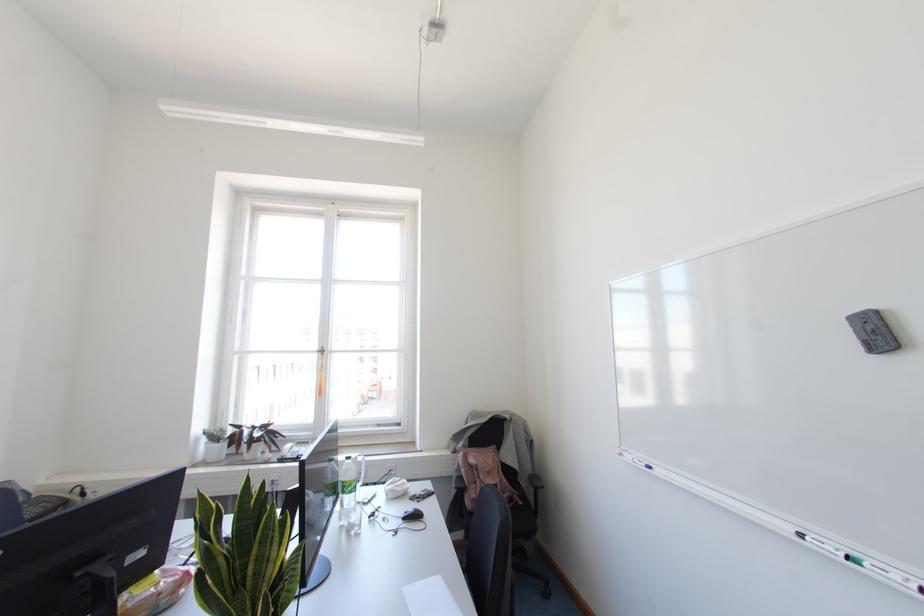
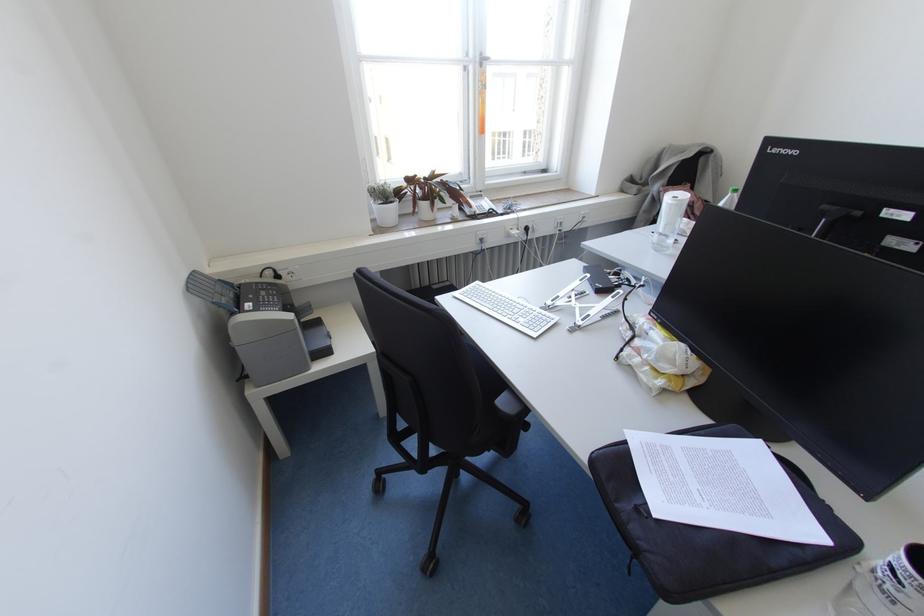
The point at (322, 353) is marked in the first image. Where is the corresponding point in the second image?

(480, 65)